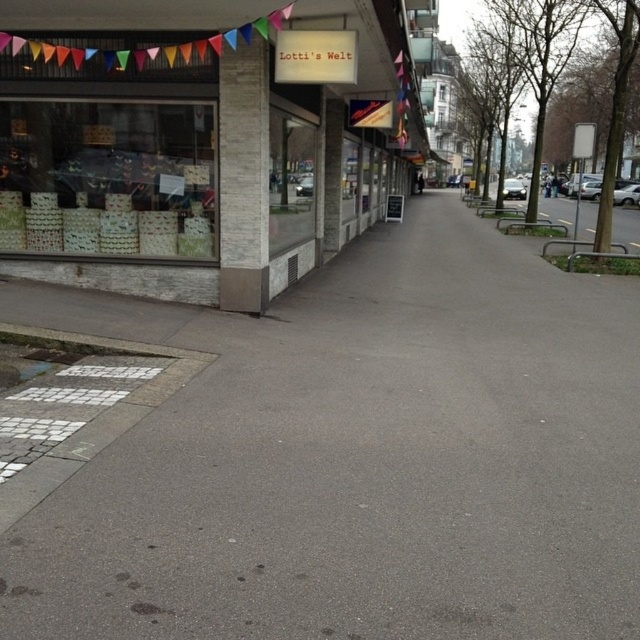
Is gray asphalt pavement at center further to camera compared to matte glass storefront at upper left?

No, it is in front of matte glass storefront at upper left.

Can you confirm if gray asphalt pavement at center is positioned to the left of matte glass storefront at upper left?

No, gray asphalt pavement at center is not to the left of matte glass storefront at upper left.

Is point (516, 280) positioned behind point (211, 136)?

Yes, point (516, 280) is behind point (211, 136).

Image resolution: width=640 pixels, height=640 pixels. I want to click on gray asphalt pavement at center, so click(x=358, y=458).